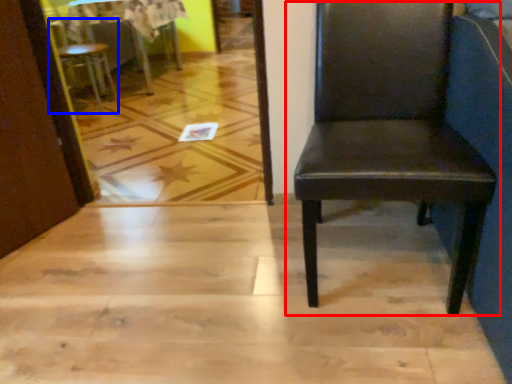
Question: Among these objects, which one is nearest to the camera, chair (highlighted by a red box) or chair (highlighted by a blue box)?

Choices:
 (A) chair
 (B) chair

Answer: (A)